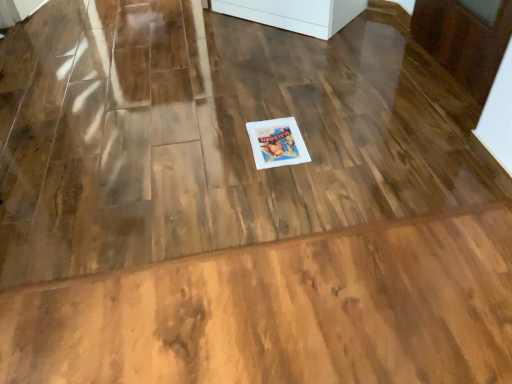
You are a GUI agent. You are given a task and a screenshot of the screen. Output one action in this format:
    pyautogui.click(x=<x>, y=<y>)
    Task: Click on the free space in front of white glossy comic book at center
    
    Given the screenshot: What is the action you would take?
    pyautogui.click(x=279, y=183)